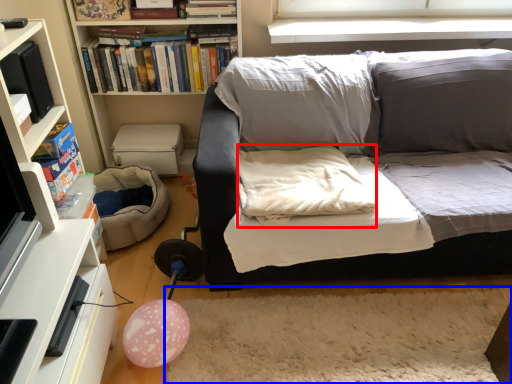
Question: Which object is closer to the camera taking this photo, pillow (highlighted by a red box) or plain (highlighted by a blue box)?

Choices:
 (A) pillow
 (B) plain

Answer: (B)